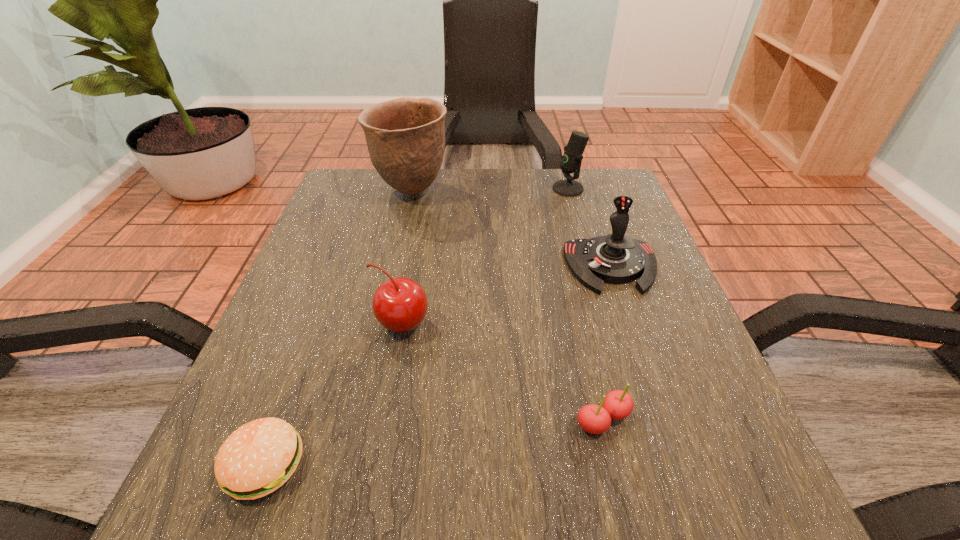
Image resolution: width=960 pixels, height=540 pixels. Identify the location of the tallest object. (405, 137).

At what (x,y) coordinates should I click in order to perform the action: click on microphone. Please return your answer as a coordinate pair (x, y). The image size is (960, 540). Looking at the image, I should click on (571, 160).

The image size is (960, 540). I want to click on the third farthest object, so click(x=617, y=259).

This screenshot has width=960, height=540. In order to click on the farther cherry in this screenshot , I will do `click(399, 304)`.

Find the location of a particular element. the left cherry is located at coordinates (399, 304).

The height and width of the screenshot is (540, 960). Find the location of `the nearer cherry`. the nearer cherry is located at coordinates (595, 419).

The height and width of the screenshot is (540, 960). I want to click on the right cherry, so click(595, 419).

What are the coordinates of `the shortest object` in the screenshot? It's located at (259, 457).

The width and height of the screenshot is (960, 540). Find the location of `vacant region located 0.120m on the right of the tallest object`. vacant region located 0.120m on the right of the tallest object is located at coordinates (498, 191).

Where is `vacant space located 0.330m on the front of the microphone`? vacant space located 0.330m on the front of the microphone is located at coordinates (596, 287).